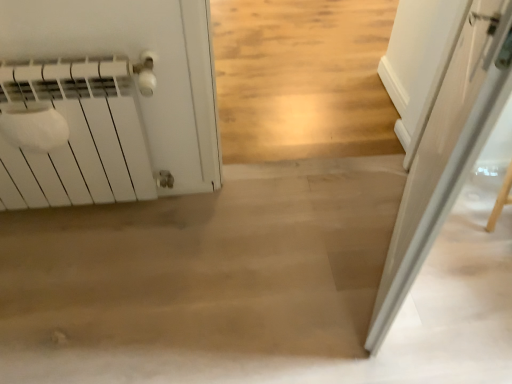
This screenshot has height=384, width=512. Find the location of `vacant space to the right of white glossy door at right`. vacant space to the right of white glossy door at right is located at coordinates (470, 253).